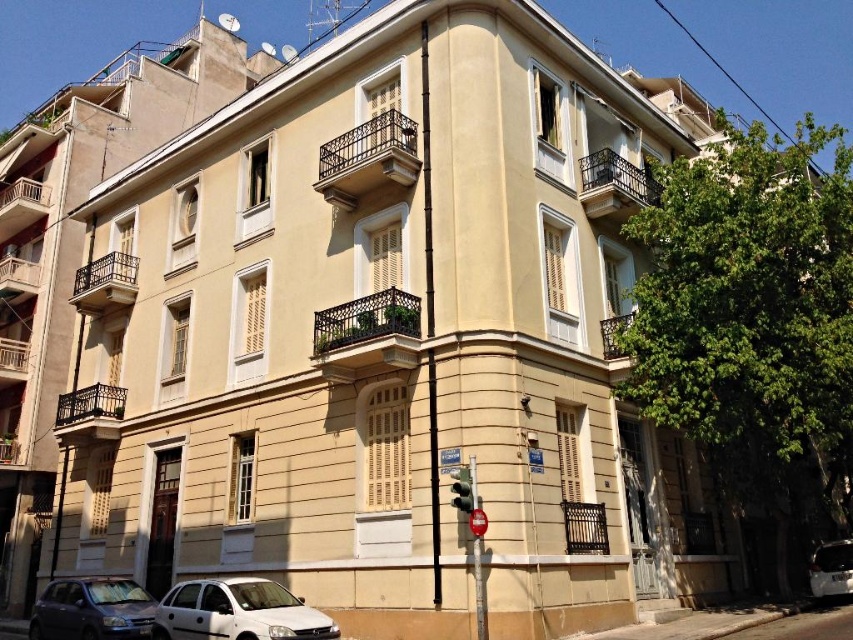
Between white matte car at lower center and metallic gray car at lower left, which one has more height?

With more height is white matte car at lower center.

Between white matte car at lower center and metallic gray car at lower left, which one is positioned higher?

white matte car at lower center

Is point (309, 621) positioned after point (149, 625)?

No, (309, 621) is closer to viewer.

This screenshot has height=640, width=853. Identify the location of white matte car at lower center. (236, 611).

Does white matte car at lower center appear under green glass traffic light at lower center?

Yes, white matte car at lower center is below green glass traffic light at lower center.

Between point (235, 637) and point (465, 490), which one is positioned behind?

Point (465, 490)

The image size is (853, 640). In order to click on white matte car at lower center in this screenshot , I will do `click(236, 611)`.

Is metallic gray car at lower left thinner than green glass traffic light at lower center?

Yes, metallic gray car at lower left is thinner than green glass traffic light at lower center.

Can you confirm if metallic gray car at lower left is positioned to the right of green glass traffic light at lower center?

Incorrect, metallic gray car at lower left is not on the right side of green glass traffic light at lower center.

Is point (138, 588) farther from viewer compared to point (459, 474)?

Yes, it is behind point (459, 474).

Find the location of a particular element. Image resolution: width=853 pixels, height=640 pixels. metallic gray car at lower left is located at coordinates (91, 609).